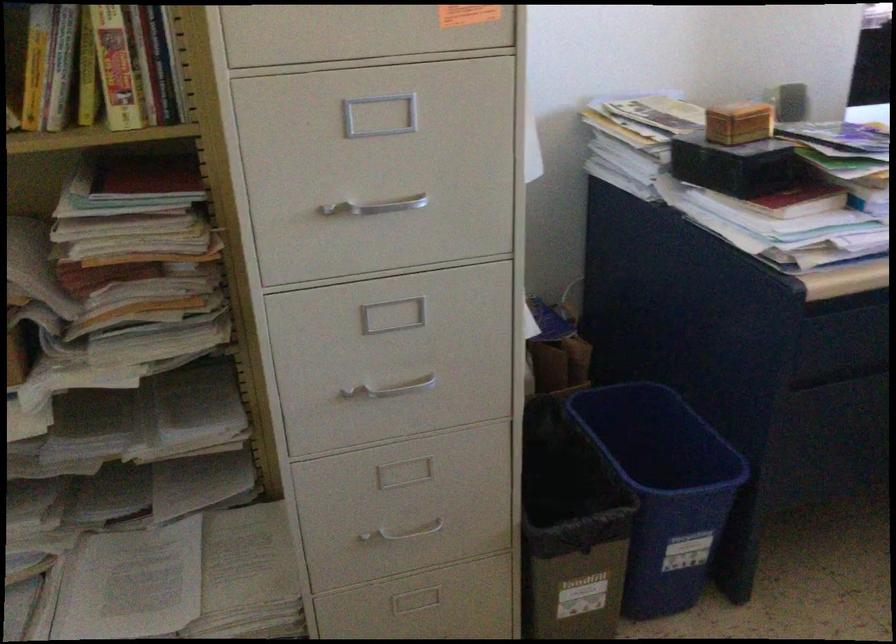
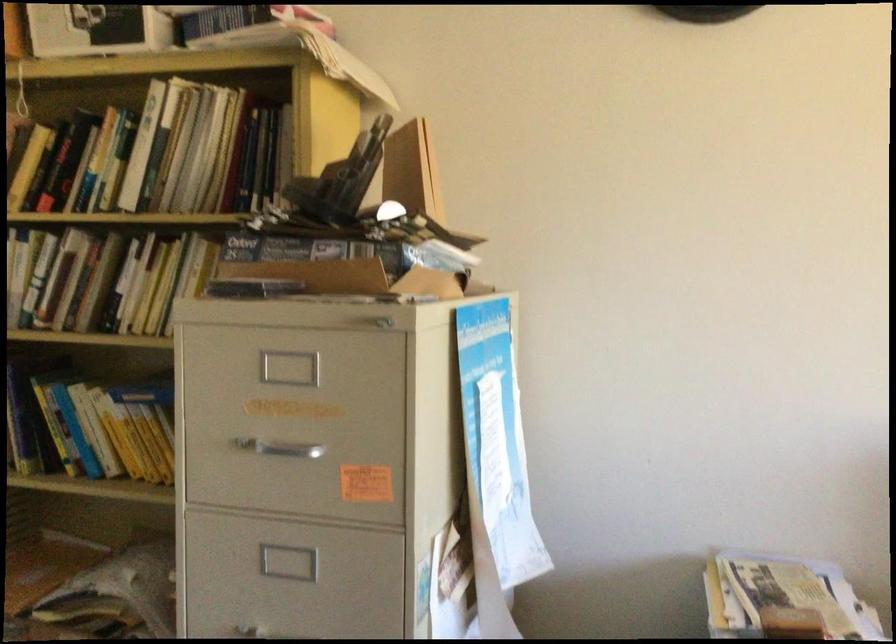
The first image is from the beginning of the video and the second image is from the end. How did the camera likely rotate when shooting the video?

The camera's rotation is toward left-up.